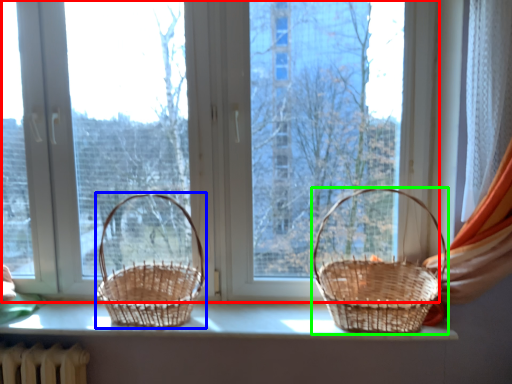
Question: Considering the real-world distances, which object is closest to window (highlighted by a red box)? picnic basket (highlighted by a blue box) or picnic basket (highlighted by a green box).

Choices:
 (A) picnic basket
 (B) picnic basket

Answer: (A)